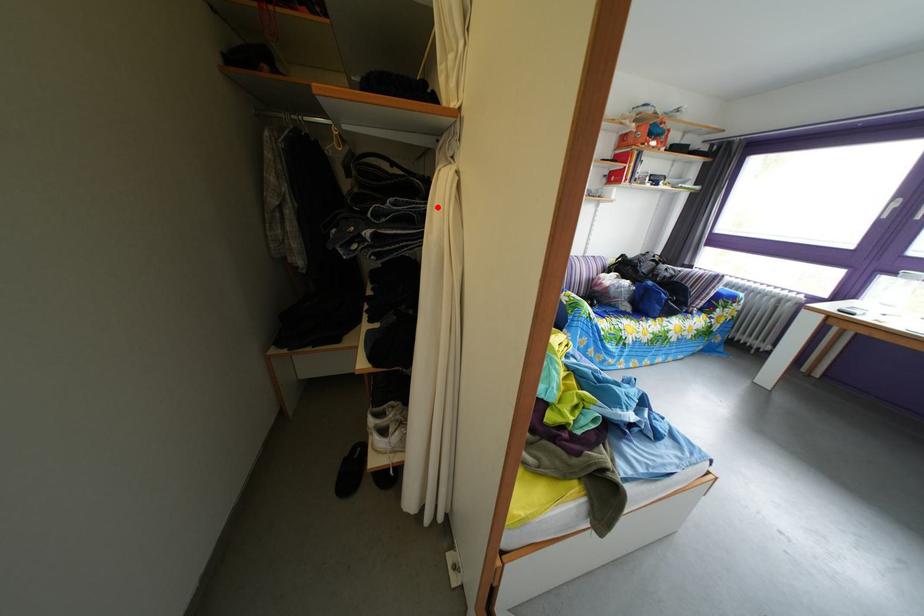
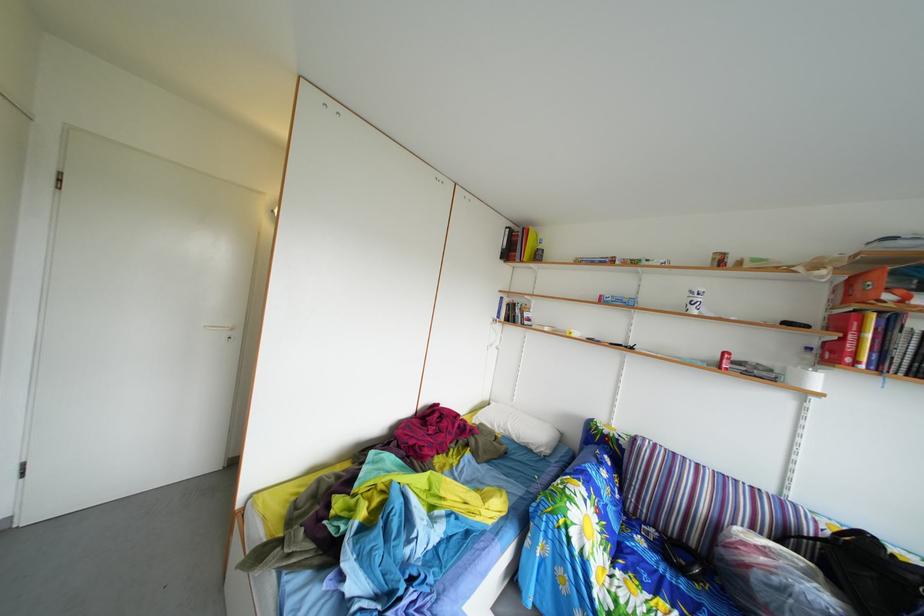
Question: I am providing you with two images of the same scene from different viewpoints. A red point is marked on the first image. Can you still see the location of the red point in image 2?

Choices:
 (A) Yes
 (B) No

Answer: (B)